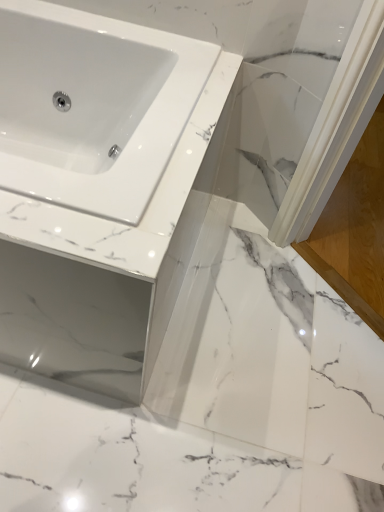
Question: Is white marble screen door at lower right wider than white marble countertop at center?

Choices:
 (A) no
 (B) yes

Answer: (B)

Question: Is white marble screen door at lower right at the left side of white marble countertop at center?

Choices:
 (A) yes
 (B) no

Answer: (B)

Question: Can you confirm if white marble screen door at lower right is shorter than white marble countertop at center?

Choices:
 (A) yes
 (B) no

Answer: (A)

Question: Does white marble screen door at lower right appear on the right side of white marble countertop at center?

Choices:
 (A) yes
 (B) no

Answer: (A)

Question: From the image's perspective, is white marble screen door at lower right beneath white marble countertop at center?

Choices:
 (A) no
 (B) yes

Answer: (A)

Question: Is white marble screen door at lower right facing away from white marble countertop at center?

Choices:
 (A) no
 (B) yes

Answer: (A)

Question: Considering the relative positions of white marble countertop at center and white marble screen door at lower right in the image provided, is white marble countertop at center to the right of white marble screen door at lower right from the viewer's perspective?

Choices:
 (A) no
 (B) yes

Answer: (A)

Question: From the image's perspective, is white marble countertop at center on top of white marble screen door at lower right?

Choices:
 (A) no
 (B) yes

Answer: (A)

Question: Is white marble countertop at center completely or partially outside of white marble screen door at lower right?

Choices:
 (A) yes
 (B) no

Answer: (A)

Question: From a real-world perspective, does white marble countertop at center sit lower than white marble screen door at lower right?

Choices:
 (A) no
 (B) yes

Answer: (A)

Question: Can you confirm if white marble countertop at center is taller than white marble screen door at lower right?

Choices:
 (A) yes
 (B) no

Answer: (A)

Question: Is white marble countertop at center wider than white marble screen door at lower right?

Choices:
 (A) no
 (B) yes

Answer: (A)

Question: From the image's perspective, relative to white marble countertop at center, is white marble screen door at lower right above or below?

Choices:
 (A) above
 (B) below

Answer: (A)